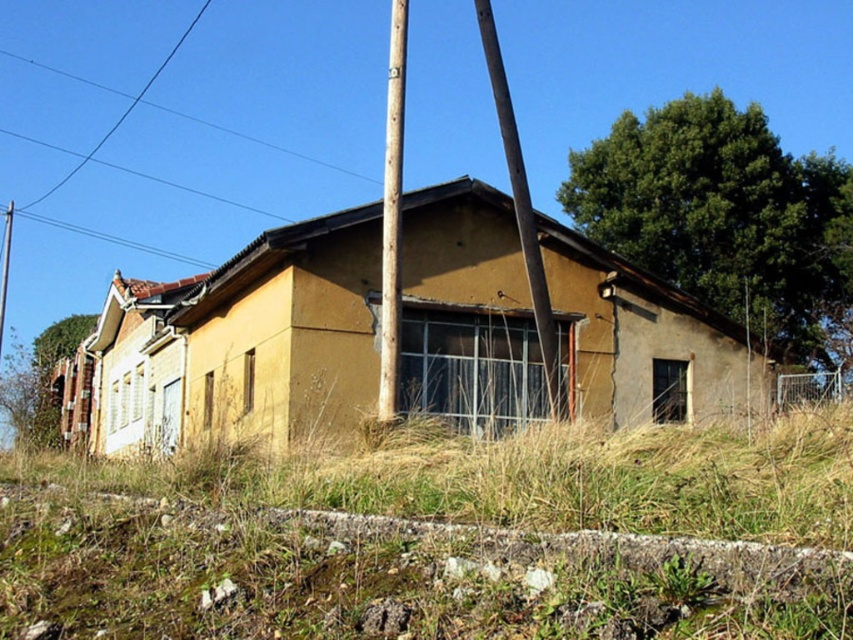
You are a construction worker assessing the structural integrity of the building. You notice two poles supporting the roof. The brown wooden pole at center and the metallic pole at left. Which pole is more likely to be weaker in terms of structural support?

The brown wooden pole at center is thinner than the metallic pole at left, so it is more likely to be weaker in terms of structural support.

You are a maintenance worker inspecting the old building. You notice dry grass at lower center and a brown wooden pole at center. Which object is taller?

The brown wooden pole at center is taller than the dry grass at lower center.